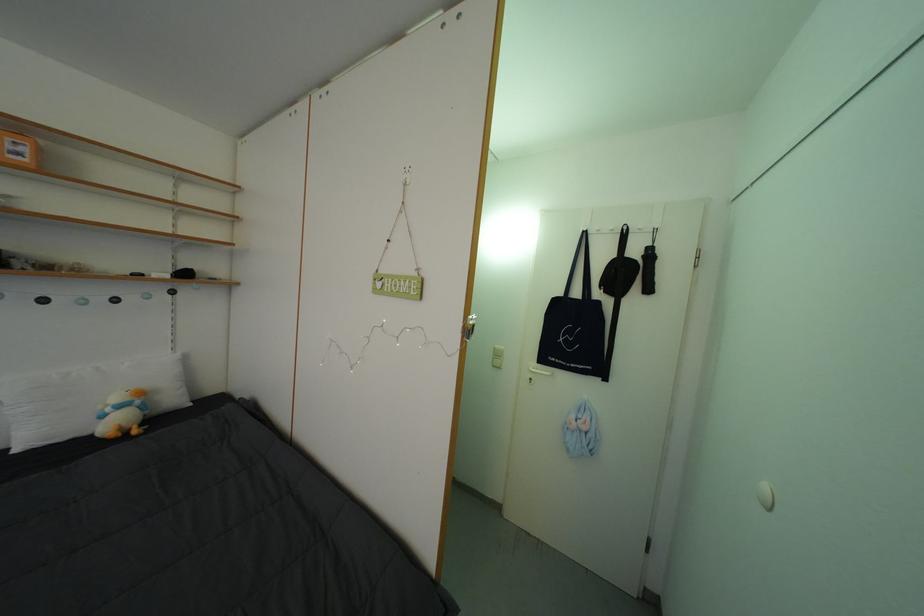
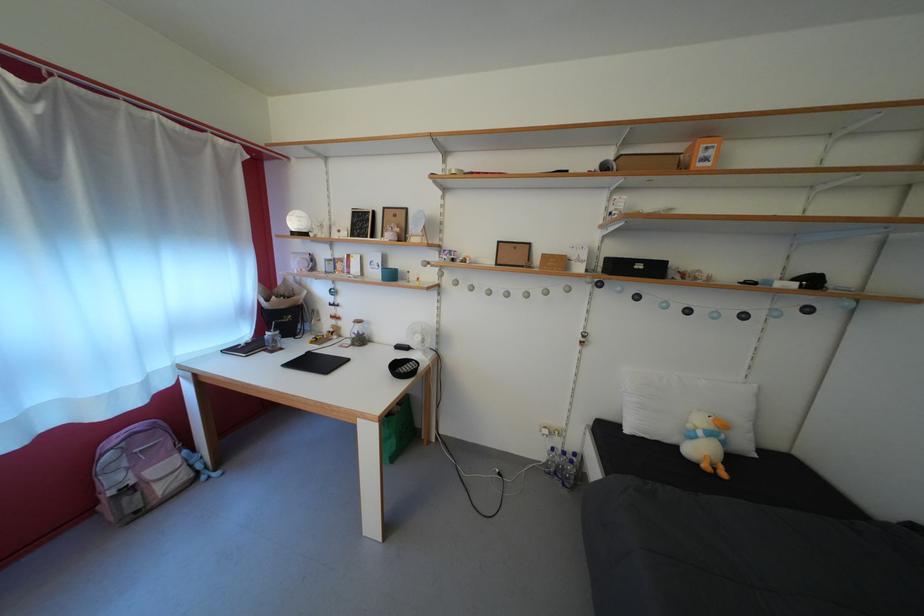
Find the pixel in the second image that matches point (152, 413) in the first image.

(732, 448)